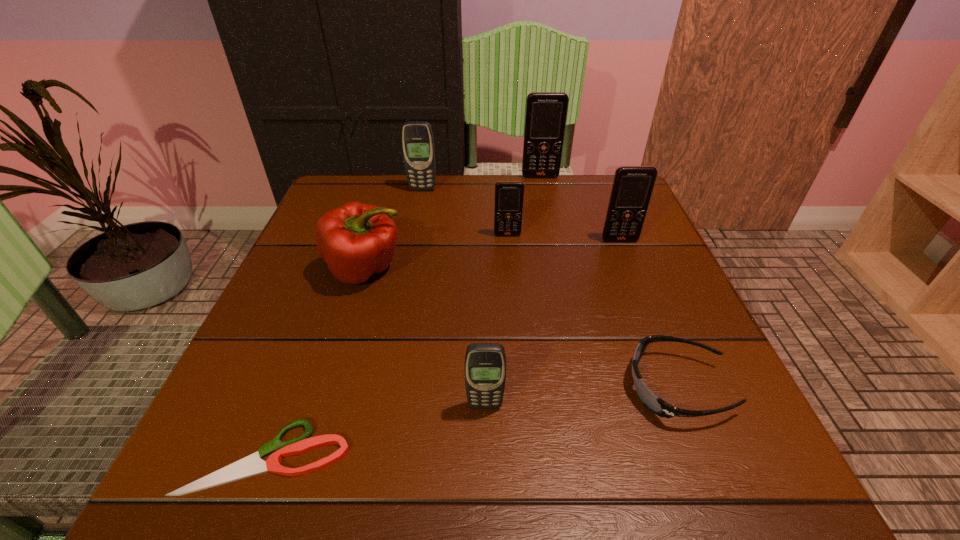
Find the location of a particular element. Image resolution: width=960 pixels, height=540 pixels. the farthest cellular telephone is located at coordinates (546, 112).

Locate an element on the screen. The width and height of the screenshot is (960, 540). the farthest object is located at coordinates (546, 112).

Locate an element on the screen. This screenshot has width=960, height=540. the seventh nearest object is located at coordinates click(417, 138).

At what (x,y) coordinates should I click in order to perform the action: click on the bigger gray cellular telephone. Please return your answer as a coordinate pair (x, y). The image size is (960, 540). Looking at the image, I should click on (417, 138).

Find the location of `the fourth farthest object`. the fourth farthest object is located at coordinates (632, 187).

This screenshot has height=540, width=960. I want to click on the nearest orange cellular telephone, so click(632, 187).

This screenshot has height=540, width=960. Identify the location of pink bell pepper. (356, 240).

Find the location of a particular element. Image resolution: width=960 pixels, height=540 pixels. the fourth nearest object is located at coordinates (356, 240).

Where is `the second nearest orange cellular telephone`? This screenshot has height=540, width=960. the second nearest orange cellular telephone is located at coordinates (509, 195).

Image resolution: width=960 pixels, height=540 pixels. Find the location of `the leftmost orange cellular telephone`. the leftmost orange cellular telephone is located at coordinates (509, 195).